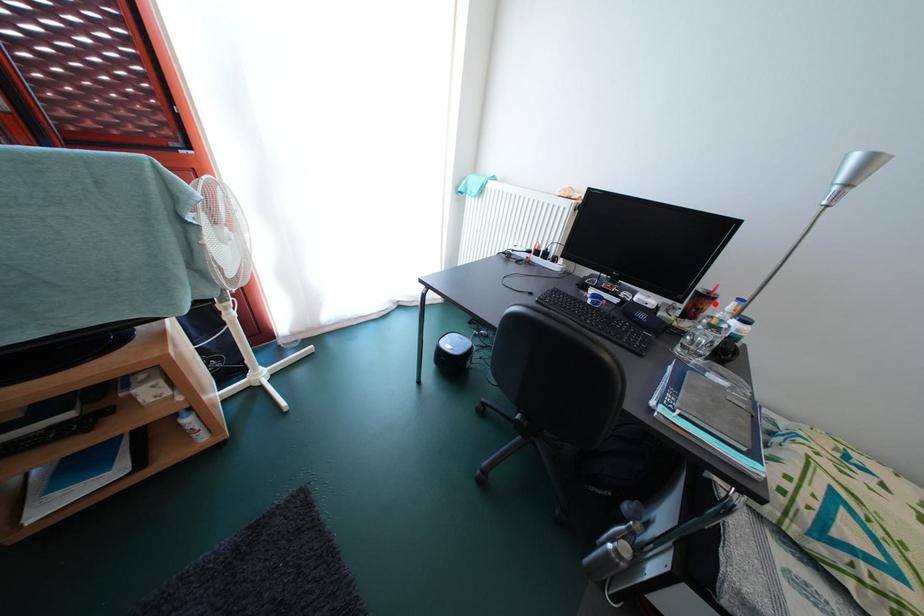
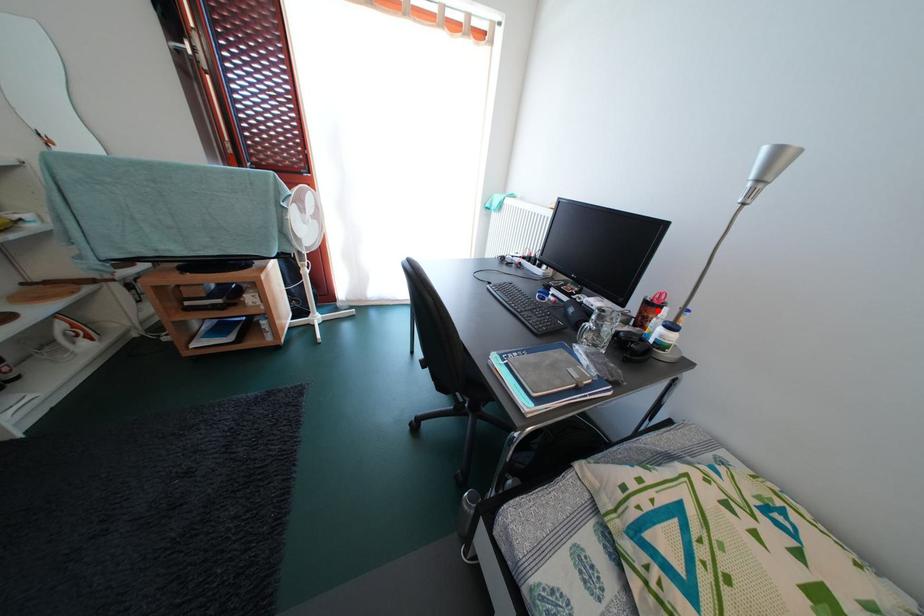
I am providing you with two images of the same scene from different viewpoints. A red point is marked on the first image and another point is marked on the second image. Do the highlighted points in image1 and image2 indicate the same real-world spot?

Yes